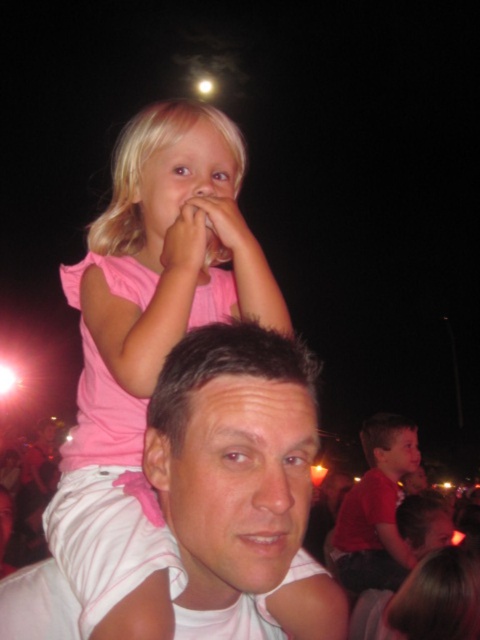
You are a photographer trying to capture the best shot of the scene. You notice the pink fabric at upper left and the matte pink shirt at upper center. Which object would you focus on if you want to highlight something larger in the frame?

The pink fabric at upper left is larger in size than the matte pink shirt at upper center, so focusing on the pink fabric at upper left would highlight the larger object in the frame.

You are standing in the nighttime scene and want to locate the pink fabric at upper left and the smooth brown hair at center. Which object is positioned to the left of the other?

The pink fabric at upper left is to the left of smooth brown hair at center.